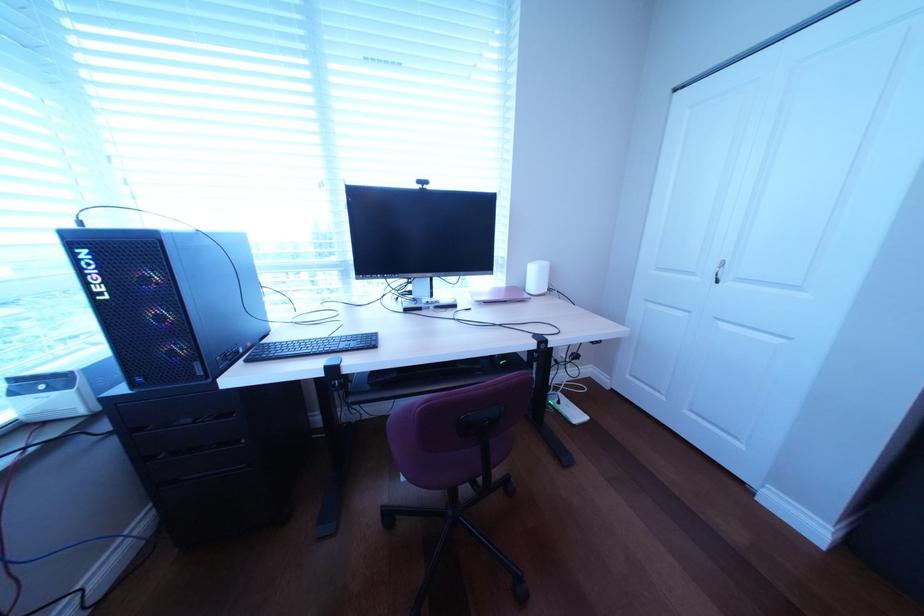
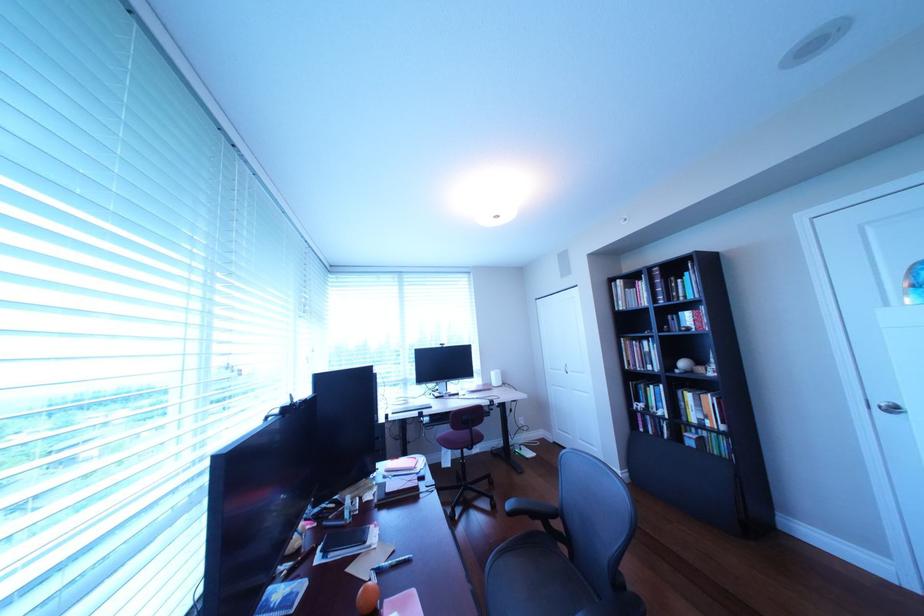
Question: In a continuous first-person perspective shot, in which direction is the camera moving?

Choices:
 (A) Left
 (B) Right
 (C) Forward
 (D) Backward

Answer: (D)